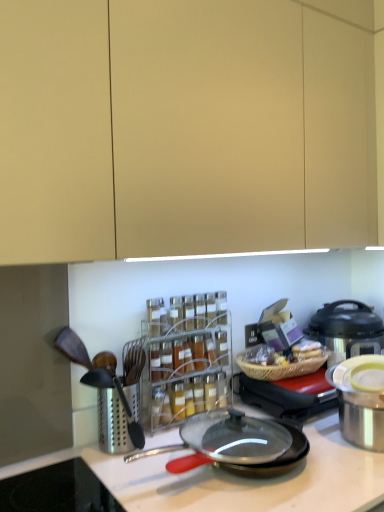
Question: Is clear plastic spice rack at center situated inside black non-stick frying pan at center or outside?

Choices:
 (A) inside
 (B) outside

Answer: (B)

Question: From their relative heights in the image, would you say clear plastic spice rack at center is taller or shorter than black non-stick frying pan at center?

Choices:
 (A) tall
 (B) short

Answer: (A)

Question: Which of these objects is positioned farthest from the stainless steel pot at right, the 1th appliance positioned from the front?

Choices:
 (A) metallic silver pot at right, arranged as the first appliance when viewed from the back
 (B) black non-stick frying pan at center
 (C) clear plastic spice rack at center
 (D) stainless steel grater at left
 (E) metallic silver pressure cooker at right

Answer: (D)

Question: Based on their relative distances, which object is nearer to the stainless steel pot at right, the 1th appliance positioned from the front?

Choices:
 (A) black non-stick frying pan at center
 (B) clear plastic spice rack at center
 (C) stainless steel grater at left
 (D) metallic silver pot at right, which ranks as the 2th appliance in front-to-back order
 (E) metallic silver pressure cooker at right

Answer: (D)